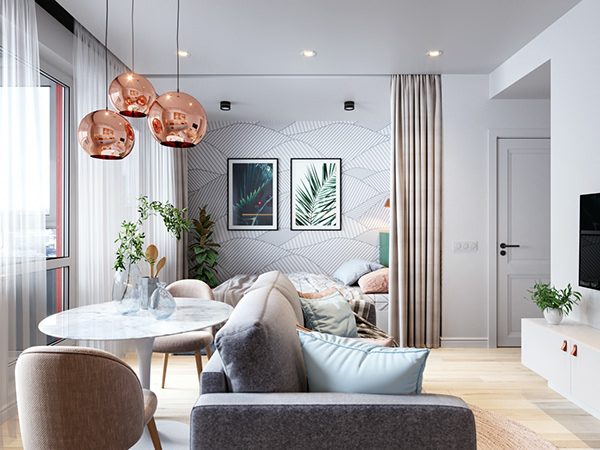
The height and width of the screenshot is (450, 600). Find the location of `wall art`. wall art is located at coordinates (266, 186), (326, 178).